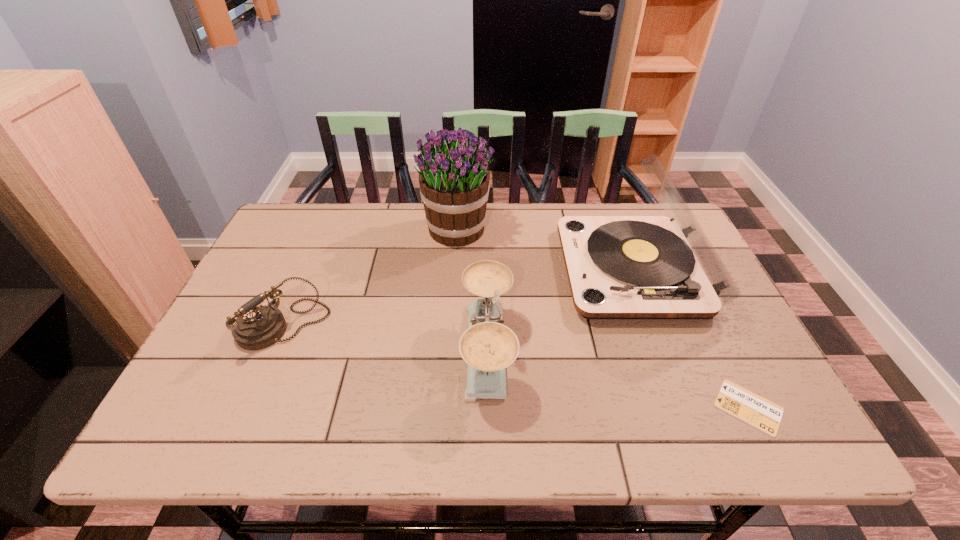
Where is `blank region between the third tallest object and the telephone`? blank region between the third tallest object and the telephone is located at coordinates (386, 338).

Identify the location of free space between the leftmost object and the third tallest object. The image size is (960, 540). (386, 338).

This screenshot has width=960, height=540. Identify the location of empty space between the third tallest object and the record player. (561, 310).

At what (x,y) coordinates should I click in order to perform the action: click on free point between the leftmost object and the bouquet. Please return your answer as a coordinate pair (x, y). The height and width of the screenshot is (540, 960). Looking at the image, I should click on (371, 277).

Image resolution: width=960 pixels, height=540 pixels. In order to click on vacant area that lies between the identity card and the record player in this screenshot , I will do `click(691, 339)`.

Where is `object that stands as the second closest to the identity card`? The width and height of the screenshot is (960, 540). object that stands as the second closest to the identity card is located at coordinates (488, 347).

Where is `object that stands as the closest to the record player`? object that stands as the closest to the record player is located at coordinates (488, 347).

In order to click on vacant space that satisfies the following two spatial constraints: 1. with the tonearm facing the front of the record player; 2. on the front side of the telephone in this screenshot , I will do `click(655, 326)`.

Identify the location of vacant space that satisfies the following two spatial constraints: 1. on the front-facing side of the third tallest object; 2. on the back side of the shortest object. (489, 407).

Identify the location of free location that satisfies the following two spatial constraints: 1. on the back side of the shortest object; 2. on the front-facing side of the scale. (720, 350).